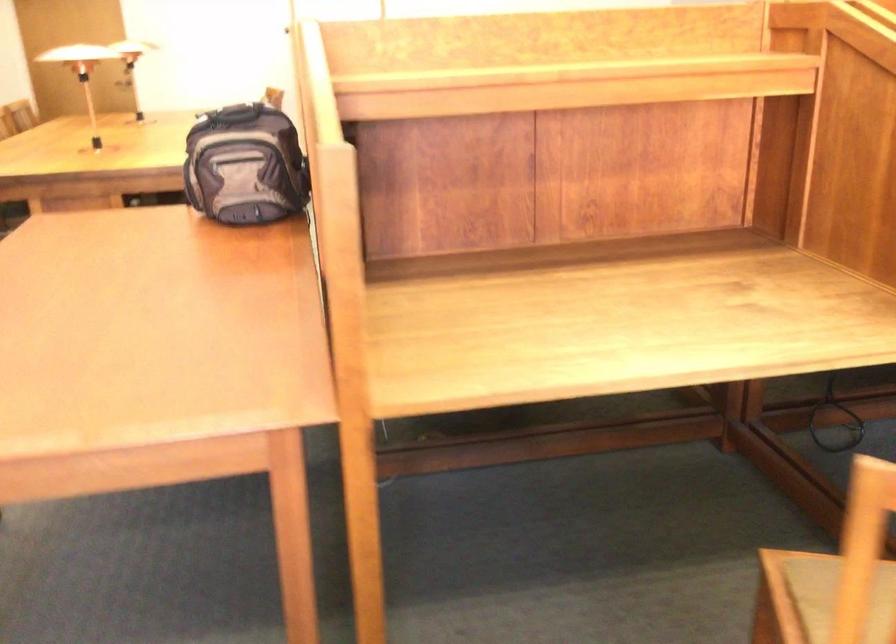
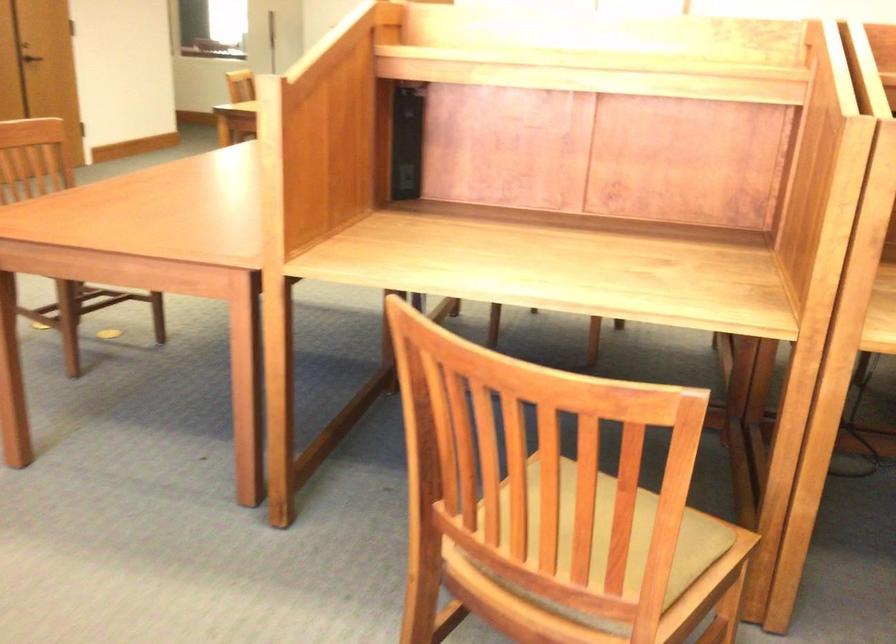
Question: How did the camera likely rotate?

Choices:
 (A) Left
 (B) Right
 (C) Up
 (D) Down

Answer: (A)